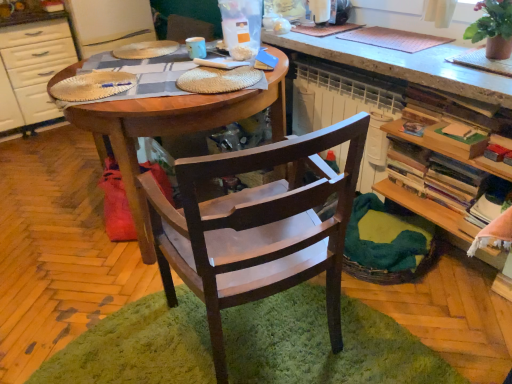
The image size is (512, 384). I want to click on wooden table at center, so click(x=173, y=129).

You are a GUI agent. You are given a task and a screenshot of the screen. Output one action in this format:
    pyautogui.click(x=<x>, y=<y>)
    Task: Click on the wooden table at center
    
    Given the screenshot: What is the action you would take?
    pyautogui.click(x=173, y=129)

Is white glossy cabinet at left spatially inside wooden table at center, or outside of it?

white glossy cabinet at left is located beyond the bounds of wooden table at center.

Which object is further away from the camera taking this photo, white glossy cabinet at left or wooden table at center?

white glossy cabinet at left is behind.

Is white glossy cabinet at left next to wooden table at center and touching it?

No, white glossy cabinet at left is not touching wooden table at center.

Which is less distant, (30, 34) or (125, 181)?

The point (125, 181) is closer.

Does wooden bookshelf at right turn towards white glossy cabinet at left?

No, wooden bookshelf at right does not turn towards white glossy cabinet at left.

Who is bigger, wooden bookshelf at right or white glossy cabinet at left?

white glossy cabinet at left.

Which is correct: wooden bookshelf at right is inside white glossy cabinet at left, or outside of it?

wooden bookshelf at right exists outside the volume of white glossy cabinet at left.

From the picture: Is wooden bookshelf at right inside or outside of woven brown basket at lower right?

The correct answer is: outside.

From their relative heights in the image, would you say wooden bookshelf at right is taller or shorter than woven brown basket at lower right?

Considering their sizes, wooden bookshelf at right has more height than woven brown basket at lower right.

Looking at this image, considering the sizes of objects wooden bookshelf at right and woven brown basket at lower right in the image provided, who is wider, wooden bookshelf at right or woven brown basket at lower right?

woven brown basket at lower right.

Does point (479, 254) come closer to viewer compared to point (433, 226)?

Yes, it is in front of point (433, 226).

From the picture: From the image's perspective, is green shaggy rug at center above or below woven brown basket at lower right?

green shaggy rug at center is situated lower than woven brown basket at lower right in the image.

Looking at this image, from a real-world perspective, is green shaggy rug at center beneath woven brown basket at lower right?

Correct, in the physical world, green shaggy rug at center is lower than woven brown basket at lower right.

From the picture: Is green shaggy rug at center wider or thinner than woven brown basket at lower right?

Considering their sizes, green shaggy rug at center looks broader than woven brown basket at lower right.

Visually, is green shaggy rug at center positioned to the left or to the right of woven brown basket at lower right?

green shaggy rug at center is to the left of woven brown basket at lower right.

Consider the image. From a real-world perspective, relative to wooden bookshelf at right, is white glossy cabinet at left vertically above or below?

white glossy cabinet at left is situated higher than wooden bookshelf at right in the real world.

How different are the orientations of white glossy cabinet at left and wooden bookshelf at right in degrees?

The angular difference between white glossy cabinet at left and wooden bookshelf at right is 90.1 degrees.

Is white glossy cabinet at left wider or thinner than wooden bookshelf at right?

In the image, white glossy cabinet at left appears to be wider than wooden bookshelf at right.

Is white glossy cabinet at left to the right of wooden bookshelf at right from the viewer's perspective?

No.

Could you tell me if white glossy cabinet at left is facing dark wood chair at center?

Yes, white glossy cabinet at left is facing dark wood chair at center.

In the scene shown: Is white glossy cabinet at left positioned in front of dark wood chair at center?

No, it is not.

Identify the location of chair above the white glossy cabinet at left (from a real-world perspective). (258, 228).

How many degrees apart are the facing directions of white glossy cabinet at left and dark wood chair at center?

white glossy cabinet at left and dark wood chair at center are facing 172 degrees away from each other.

Based on the photo, from a real-world perspective, which object stands above the other?

white glossy cabinet at left, from a real-world perspective.

Is woven brown basket at lower right inside the boundaries of white glossy cabinet at left, or outside?

woven brown basket at lower right is located beyond the bounds of white glossy cabinet at left.

Is woven brown basket at lower right facing away from white glossy cabinet at left?

That's not correct — woven brown basket at lower right is not looking away from white glossy cabinet at left.

Which is farther, [359,226] or [16,64]?

Positioned behind is point [16,64].

Where is `cabinetry above the wooden table at center (from the image's perspective)`? Image resolution: width=512 pixels, height=384 pixels. cabinetry above the wooden table at center (from the image's perspective) is located at coordinates (32, 66).

At what (x,y) coordinates should I click in order to perform the action: click on cabinetry on the left of wooden bookshelf at right. Please return your answer as a coordinate pair (x, y). Looking at the image, I should click on (32, 66).

From the image, which object appears to be farther from white glossy cabinet at left, woven brown basket at lower right or wooden table at center?

woven brown basket at lower right.

Estimate the real-world distances between objects in this image. Which object is further from dark wood chair at center, white glossy cabinet at left or wooden bookshelf at right?

white glossy cabinet at left.

From the image, which object appears to be nearer to woven brown basket at lower right, wooden bookshelf at right or white glossy cabinet at left?

wooden bookshelf at right is positioned closer to the anchor woven brown basket at lower right.

Consider the image. Based on their spatial positions, is wooden table at center or woven brown basket at lower right further from green shaggy rug at center?

Based on the image, wooden table at center appears to be further to green shaggy rug at center.

Consider the image. From the image, which object appears to be nearer to white glossy cabinet at left, green shaggy rug at center or wooden table at center?

wooden table at center.

Looking at the image, which one is located further to wooden bookshelf at right, green shaggy rug at center or white glossy cabinet at left?

white glossy cabinet at left.

Consider the image. Considering their positions, is dark wood chair at center positioned closer to green shaggy rug at center than wooden bookshelf at right?

dark wood chair at center.

Considering their positions, is wooden table at center positioned closer to white glossy cabinet at left than wooden bookshelf at right?

Based on the image, wooden table at center appears to be nearer to white glossy cabinet at left.

Locate an element on the screen. This screenshot has width=512, height=384. basket between green shaggy rug at center and wooden bookshelf at right in the horizontal direction is located at coordinates (387, 242).

This screenshot has width=512, height=384. In order to click on chair between white glossy cabinet at left and wooden bookshelf at right in this screenshot , I will do `click(258, 228)`.

Identify the location of mat between white glossy cabinet at left and wooden bookshelf at right. This screenshot has width=512, height=384. (324, 344).

Find the location of `desk between white glossy cabinet at left and woven brown basket at lower right`. desk between white glossy cabinet at left and woven brown basket at lower right is located at coordinates (173, 129).